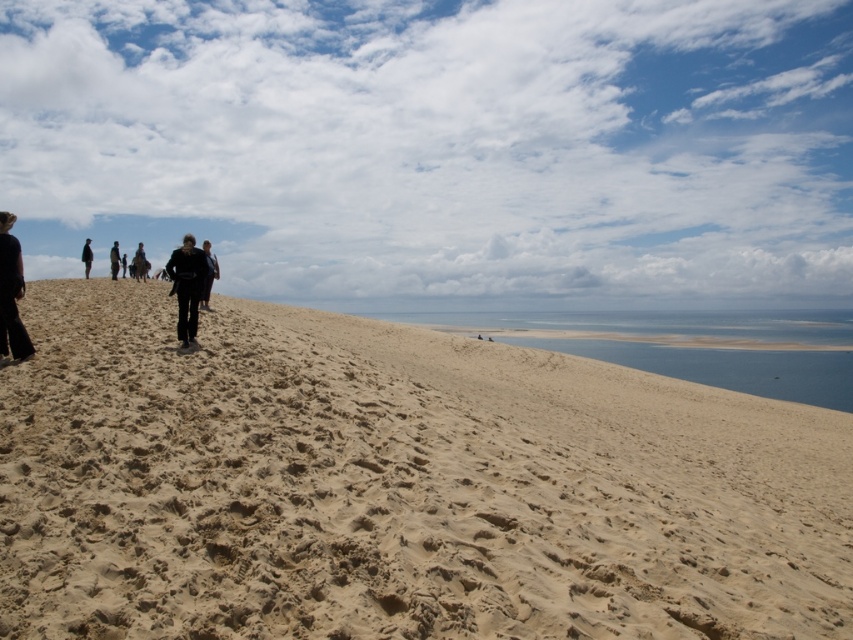
Question: Which of these objects is positioned farthest from the black leather jacket at upper center?

Choices:
 (A) dark brown leather jacket at left
 (B) black matte jacket at center
 (C) black fabric person at upper center

Answer: (A)

Question: Considering the relative positions of black matte jacket at center and black leather jacket at upper center in the image provided, where is black matte jacket at center located with respect to black leather jacket at upper center?

Choices:
 (A) below
 (B) above

Answer: (A)

Question: Which of the following is the closest to the observer?

Choices:
 (A) black fabric person at upper center
 (B) black matte pants at center
 (C) light beige sand at upper center
 (D) black matte jacket at upper left

Answer: (C)

Question: Does light beige sand at upper center have a smaller size compared to black matte pants at center?

Choices:
 (A) no
 (B) yes

Answer: (A)

Question: Is light beige sand at upper center to the right of dark brown leather jacket at left from the viewer's perspective?

Choices:
 (A) yes
 (B) no

Answer: (A)

Question: Which of the following is the farthest from the observer?

Choices:
 (A) (115, 253)
 (B) (215, 276)
 (C) (141, 268)

Answer: (A)